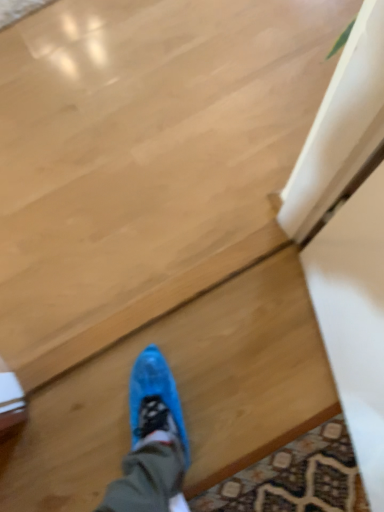
Measure the distance between point (92, 448) and camera.

The depth of point (92, 448) is 1.10 meters.

At what (x,y) coordinates should I click in order to perform the action: click on blue plastic shoe at center. Please return your answer as a coordinate pair (x, y). The height and width of the screenshot is (512, 384). Looking at the image, I should click on (179, 391).

Image resolution: width=384 pixels, height=512 pixels. What do you see at coordinates (179, 391) in the screenshot?
I see `blue plastic shoe at center` at bounding box center [179, 391].

Image resolution: width=384 pixels, height=512 pixels. I want to click on blue plastic shoe at center, so click(179, 391).